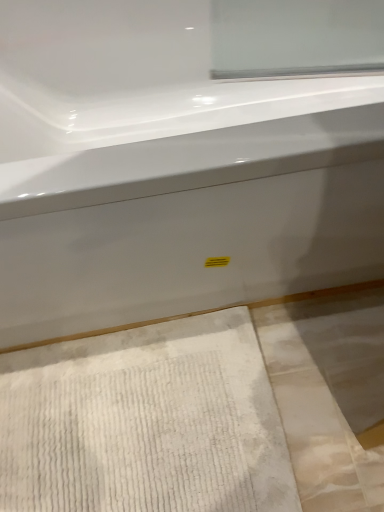
Question: Is white textured bath mat at lower left taller or shorter than white glossy bathtub at center?

Choices:
 (A) short
 (B) tall

Answer: (A)

Question: From a real-world perspective, is white textured bath mat at lower left physically located above or below white glossy bathtub at center?

Choices:
 (A) below
 (B) above

Answer: (A)

Question: Based on their positions, is white textured bath mat at lower left located to the left or right of white glossy bathtub at center?

Choices:
 (A) left
 (B) right

Answer: (A)

Question: From the image's perspective, relative to white textured bath mat at lower left, is white glossy bathtub at center above or below?

Choices:
 (A) below
 (B) above

Answer: (B)

Question: From a real-world perspective, is white glossy bathtub at center above or below white textured bath mat at lower left?

Choices:
 (A) above
 (B) below

Answer: (A)

Question: Choose the correct answer: Is white glossy bathtub at center inside white textured bath mat at lower left or outside it?

Choices:
 (A) inside
 (B) outside

Answer: (B)

Question: Considering their positions, is white glossy bathtub at center located in front of or behind white textured bath mat at lower left?

Choices:
 (A) front
 (B) behind

Answer: (A)